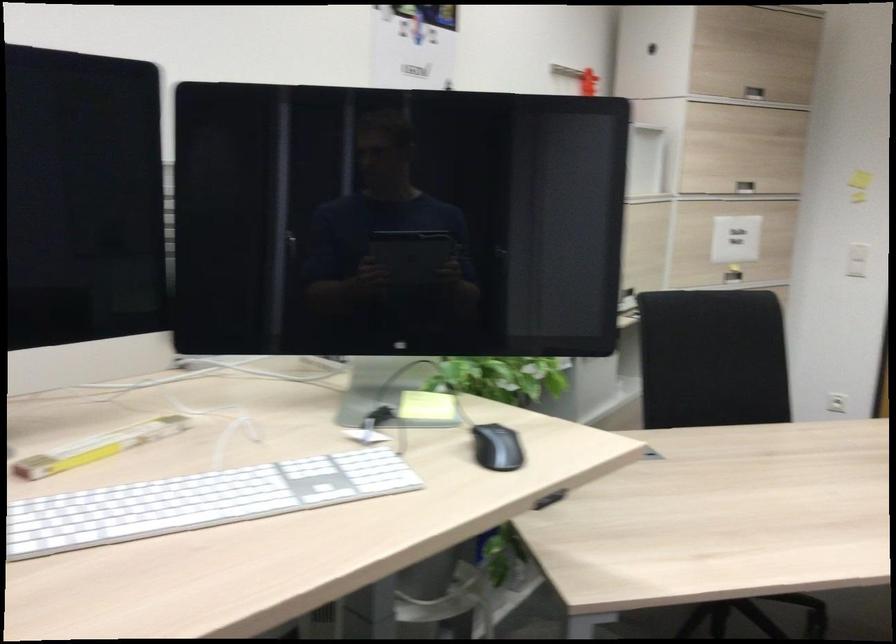
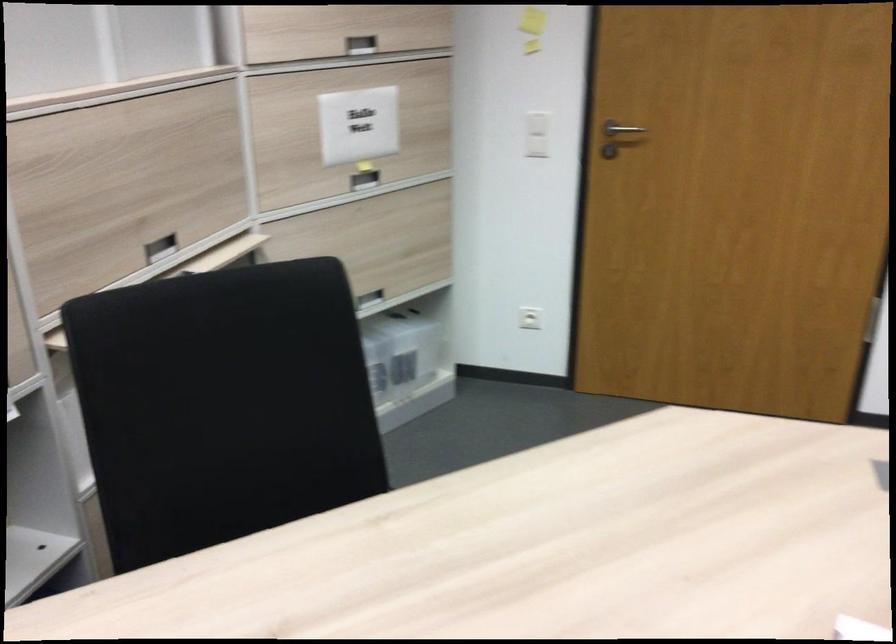
Question: I am providing you with two images of the same scene from different viewpoints. After the viewpoint changes to image2, which objects are now occluded?

Choices:
 (A) white light switch
 (B) recessed cabinet handle
 (C) metal door handle
 (D) none of these

Answer: (D)